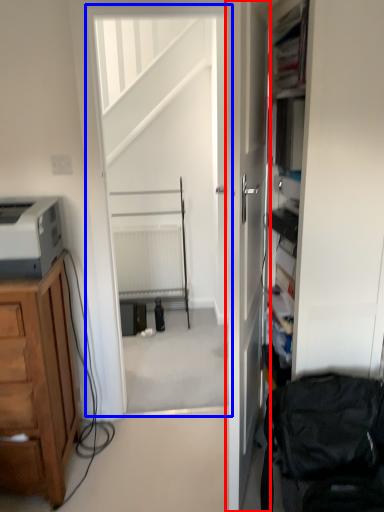
Question: Which object appears farthest to the camera in this image, door (highlighted by a red box) or screen door (highlighted by a blue box)?

Choices:
 (A) door
 (B) screen door

Answer: (B)